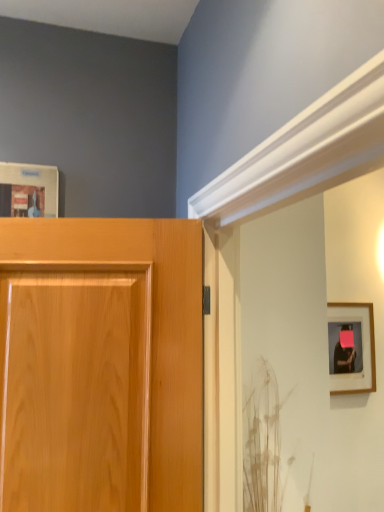
What do you see at coordinates (370, 347) in the screenshot?
I see `wooden picture frame at upper right` at bounding box center [370, 347].

Find the location of a particular element. The image size is (384, 512). wooden picture frame at upper right is located at coordinates (370, 347).

The height and width of the screenshot is (512, 384). Find the location of `wooden picture frame at upper right`. wooden picture frame at upper right is located at coordinates (370, 347).